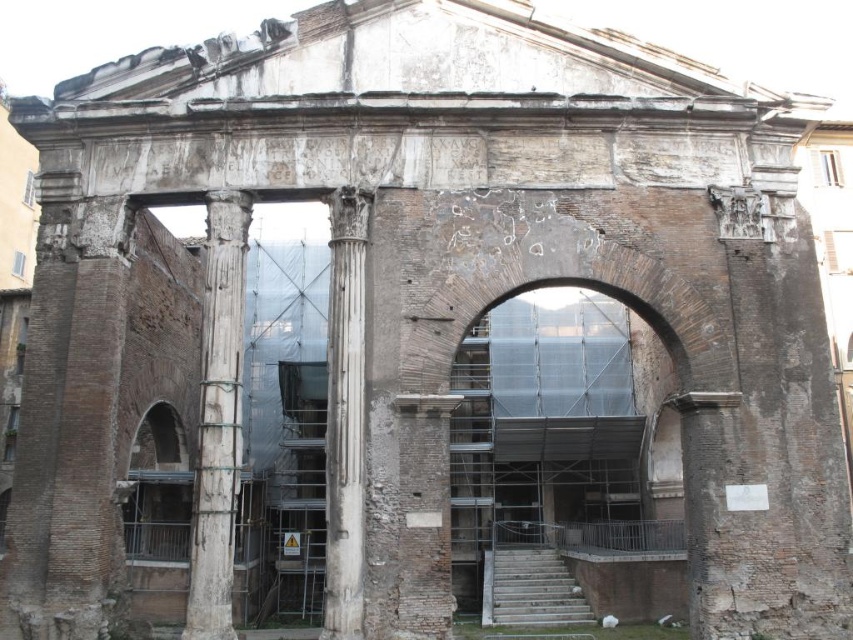
You are an architect inspecting the Roman structure. You notice a point marked at coordinates (218, 419). What object is located at this point?

The point at coordinates (218, 419) indicates a white marble column at left.

You are an architect examining the Roman structure. You notice the white marble column at left and the white marble column at center. Which column is positioned higher relative to the other?

The white marble column at left is located above the white marble column at center, so it is positioned higher.